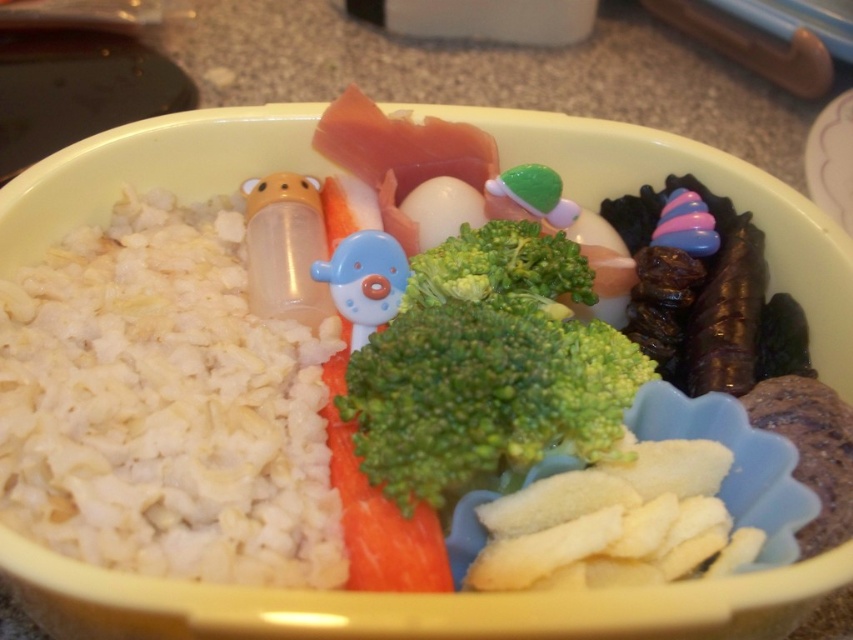
Does white fluffy rice at left have a lesser width compared to green fresh carrot at center?

No, white fluffy rice at left is not thinner than green fresh carrot at center.

Is white fluffy rice at left wider than green fresh carrot at center?

Indeed, white fluffy rice at left has a greater width compared to green fresh carrot at center.

Between point (296, 417) and point (438, 570), which one is positioned behind?

Positioned behind is point (296, 417).

The height and width of the screenshot is (640, 853). In order to click on white fluffy rice at left in this screenshot , I will do `click(164, 406)`.

Does white fluffy rice at left appear on the right side of green fresh broccoli at center?

In fact, white fluffy rice at left is to the left of green fresh broccoli at center.

Does white fluffy rice at left have a lesser width compared to green fresh broccoli at center?

No, white fluffy rice at left is not thinner than green fresh broccoli at center.

Is point (79, 467) closer to viewer compared to point (601, 451)?

Yes.

You are a GUI agent. You are given a task and a screenshot of the screen. Output one action in this format:
    pyautogui.click(x=<x>, y=<y>)
    Task: Click on the white fluffy rice at left
    Image resolution: width=853 pixels, height=640 pixels.
    Given the screenshot: What is the action you would take?
    pyautogui.click(x=164, y=406)

Which is below, green fresh broccoli at center or green fresh carrot at center?

green fresh carrot at center

Consider the image. Who is shorter, green fresh broccoli at center or green fresh carrot at center?

Standing shorter between the two is green fresh carrot at center.

Between point (469, 480) and point (366, 582), which one is positioned in front?

Point (366, 582) is in front.

Find the location of a particular element. green fresh broccoli at center is located at coordinates (486, 369).